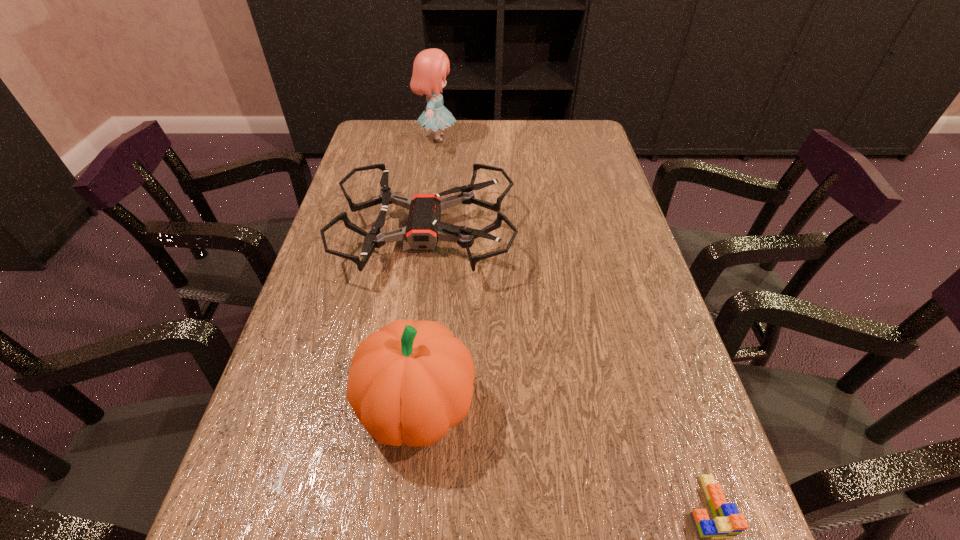
At what (x,y) coordinates should I click in order to perform the action: click on empty space between the doll and the pumpkin. Please return your answer as a coordinate pair (x, y). Looking at the image, I should click on (427, 272).

Locate an element on the screen. vacant space that's between the second nearest object and the farthest object is located at coordinates (427, 272).

Where is `free space between the doll and the Lego`? This screenshot has height=540, width=960. free space between the doll and the Lego is located at coordinates (571, 322).

What are the coordinates of `vacant area that lies between the drone and the rightmost object` in the screenshot? It's located at (565, 370).

Identify the location of free spot between the pumpkin and the Lego. The image size is (960, 540). (562, 456).

This screenshot has height=540, width=960. I want to click on unoccupied area between the second farthest object and the farthest object, so click(431, 186).

The height and width of the screenshot is (540, 960). Identify the location of free area in between the rightmost object and the drone. (565, 370).

Find the location of a particular element. This screenshot has width=960, height=540. vacant region between the tallest object and the rightmost object is located at coordinates (571, 322).

Locate an element on the screen. The height and width of the screenshot is (540, 960). vacant region between the tallest object and the third shortest object is located at coordinates (427, 272).

Select which object is the second closest to the farthest object. Please provide its 2D coordinates. Your answer should be formatted as a tuple, i.e. [(x, y)], where the tuple contains the x and y coordinates of a point satisfying the conditions above.

[(410, 381)]